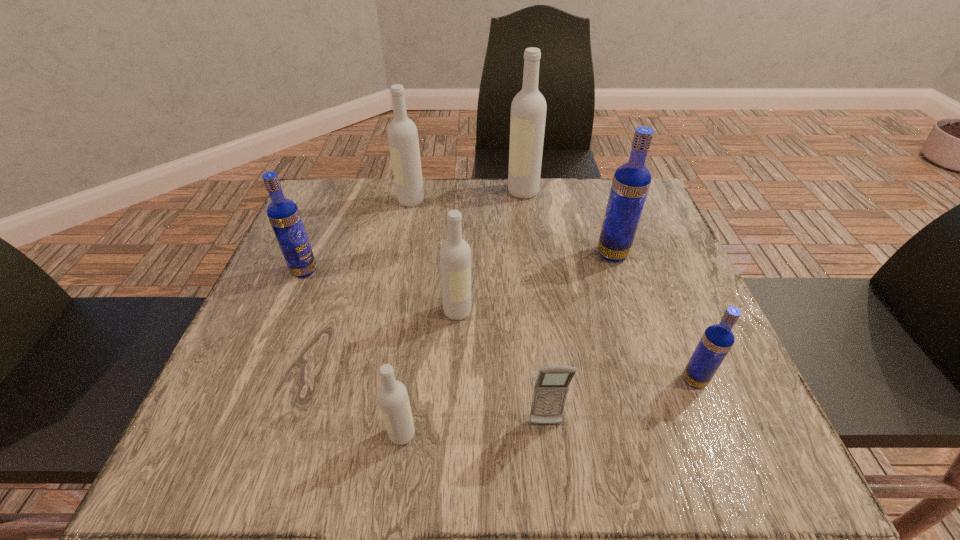
I want to click on free space in the image that satisfies the following two spatial constraints: 1. on the back side of the seventh object from left to right; 2. on the left side of the leftmost vodka, so click(x=311, y=254).

You are a GUI agent. You are given a task and a screenshot of the screen. Output one action in this format:
    pyautogui.click(x=<x>, y=<y>)
    Task: Click on the vacant space that satisfies the following two spatial constraints: 1. on the front side of the leftmost object; 2. on the right side of the fourth vodka from right to left
    The width and height of the screenshot is (960, 540).
    Given the screenshot: What is the action you would take?
    pyautogui.click(x=288, y=311)

The image size is (960, 540). What are the coordinates of `vacant space that satisfies the following two spatial constraints: 1. on the front side of the rightmost object; 2. on the right side of the leftmost blue vodka` in the screenshot? It's located at (258, 380).